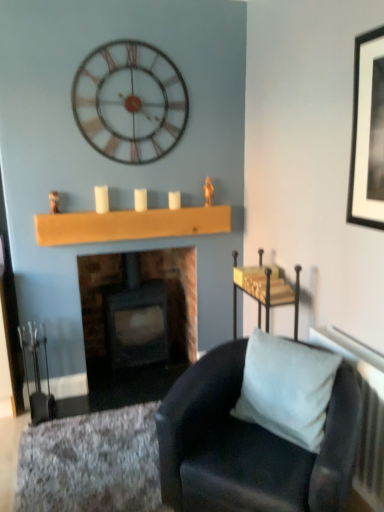
Question: Is textured gray rug at lower left looking in the opposite direction of white matte candle at center, the 1th candle in the right-to-left sequence?

Choices:
 (A) yes
 (B) no

Answer: (B)

Question: From the image's perspective, does textured gray rug at lower left appear lower than white matte candle at center, the third candle viewed from the left?

Choices:
 (A) no
 (B) yes

Answer: (B)

Question: From the image's perspective, is textured gray rug at lower left located above white matte candle at center, the third candle viewed from the left?

Choices:
 (A) no
 (B) yes

Answer: (A)

Question: Can white matte candle at center, the 1th candle in the right-to-left sequence, be found inside textured gray rug at lower left?

Choices:
 (A) yes
 (B) no

Answer: (B)

Question: Is textured gray rug at lower left wider than white matte candle at center, the third candle viewed from the left?

Choices:
 (A) no
 (B) yes

Answer: (B)

Question: Is metallic gold tray at upper right inside or outside of textured gray rug at lower left?

Choices:
 (A) inside
 (B) outside

Answer: (B)

Question: Is metallic gold tray at upper right in front of or behind textured gray rug at lower left in the image?

Choices:
 (A) front
 (B) behind

Answer: (B)

Question: Looking at their shapes, would you say metallic gold tray at upper right is wider or thinner than textured gray rug at lower left?

Choices:
 (A) thin
 (B) wide

Answer: (A)

Question: Would you say metallic gold tray at upper right is to the left or to the right of textured gray rug at lower left in the picture?

Choices:
 (A) right
 (B) left

Answer: (A)

Question: Would you say wooden plank at center is inside or outside white matte candle at center, acting as the second candle starting from the left?

Choices:
 (A) inside
 (B) outside

Answer: (B)

Question: From the image's perspective, is wooden plank at center positioned above or below white matte candle at center, the second candle viewed from the right?

Choices:
 (A) below
 (B) above

Answer: (A)

Question: Considering the relative positions of wooden plank at center and white matte candle at center, acting as the second candle starting from the left, in the image provided, is wooden plank at center to the left or to the right of white matte candle at center, acting as the second candle starting from the left,?

Choices:
 (A) left
 (B) right

Answer: (A)

Question: Does point (72, 237) appear closer or farther from the camera than point (137, 192)?

Choices:
 (A) farther
 (B) closer

Answer: (B)

Question: Considering their positions, is suede-like gray pillow at lower right located in front of or behind textured gray rug at lower left?

Choices:
 (A) behind
 (B) front

Answer: (B)

Question: In terms of height, does suede-like gray pillow at lower right look taller or shorter compared to textured gray rug at lower left?

Choices:
 (A) tall
 (B) short

Answer: (A)